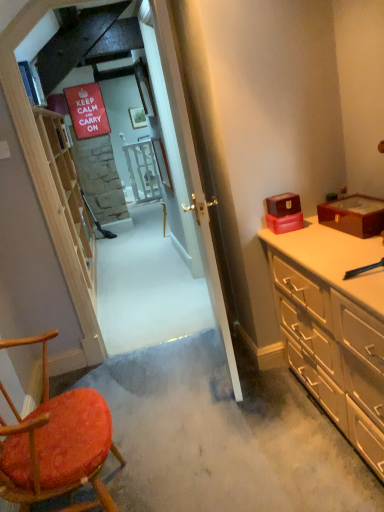
This screenshot has width=384, height=512. In order to click on empty space that is to the right of wooden textured chair at lower left in this screenshot , I will do `click(193, 467)`.